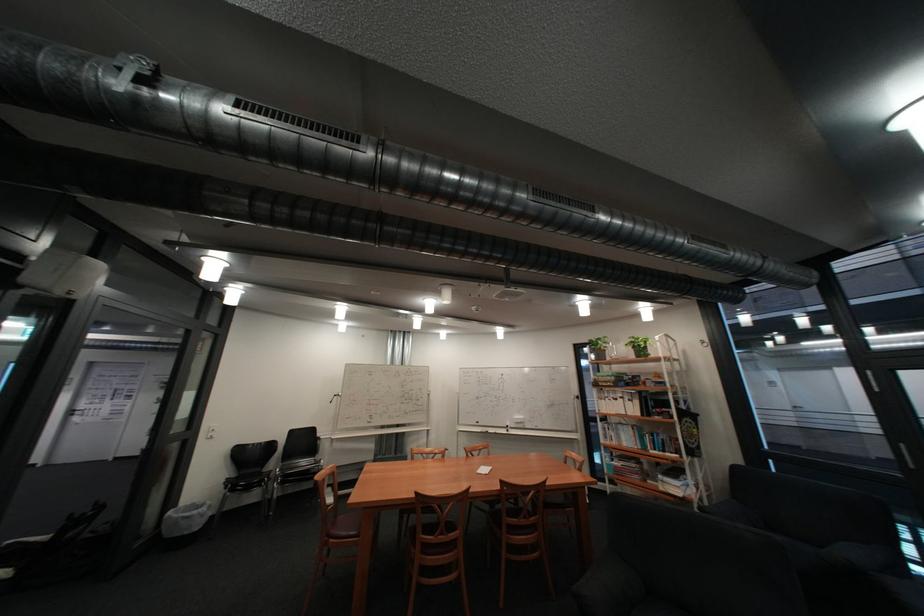
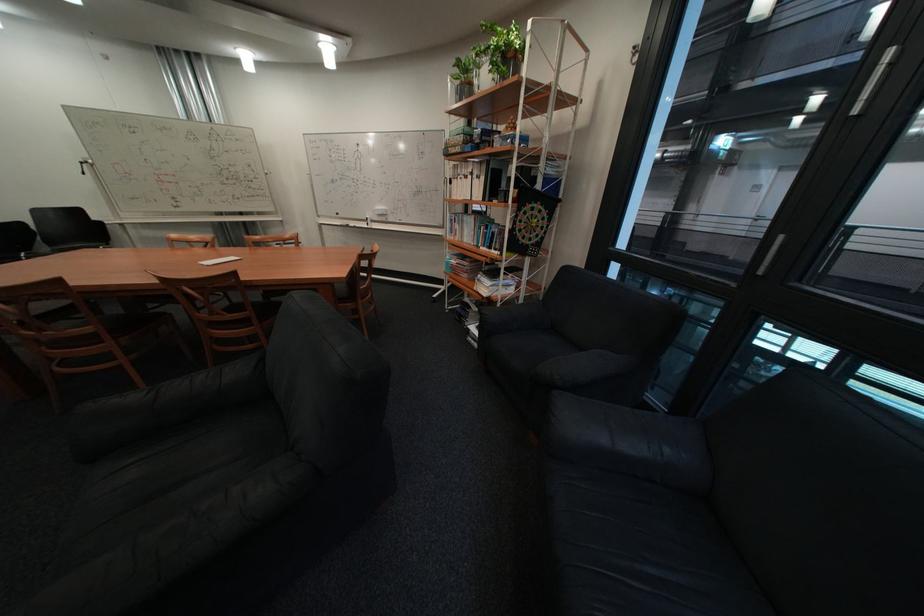
Locate, in the second image, the point that corresponds to (678,440) in the first image.

(508, 233)